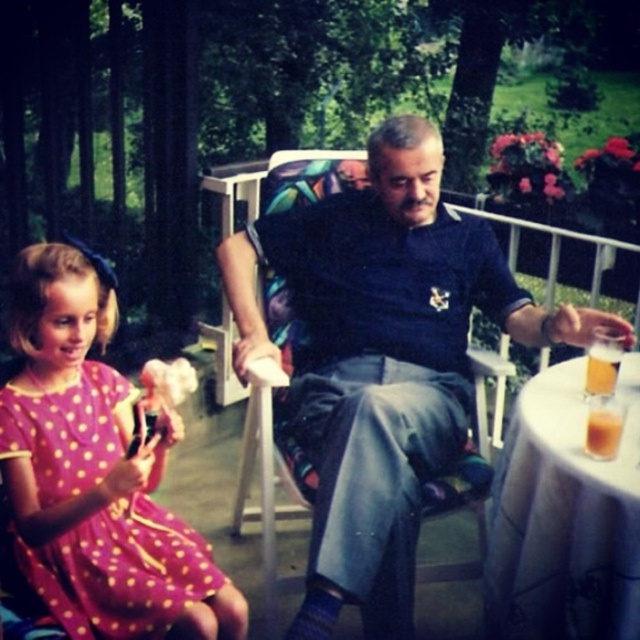
Can you confirm if white cloth-covered table at lower right is taller than translucent glass beer at table right?

Yes.

Can you confirm if white cloth-covered table at lower right is positioned to the right of translucent glass beer at table right?

Incorrect, white cloth-covered table at lower right is not on the right side of translucent glass beer at table right.

Identify the location of white cloth-covered table at lower right. The image size is (640, 640). (563, 516).

Locate an element on the screen. The width and height of the screenshot is (640, 640). white cloth-covered table at lower right is located at coordinates (563, 516).

Does pink polka dot fabric dress at lower left come behind translucent glass beverage at table right?

No.

Is pink polka dot fabric dress at lower left bigger than translucent glass beverage at table right?

Correct, pink polka dot fabric dress at lower left is larger in size than translucent glass beverage at table right.

Which is behind, point (100, 397) or point (600, 381)?

Positioned behind is point (600, 381).

Where is `pink polka dot fabric dress at lower left`? pink polka dot fabric dress at lower left is located at coordinates (120, 570).

Which is above, translucent glass beer at table right or translucent glass beverage at table right?

translucent glass beverage at table right is higher up.

You are a GUI agent. You are given a task and a screenshot of the screen. Output one action in this format:
    pyautogui.click(x=<x>, y=<y>)
    Task: Click on the translucent glass beer at table right
    This screenshot has height=640, width=640.
    Given the screenshot: What is the action you would take?
    pyautogui.click(x=604, y=429)

The width and height of the screenshot is (640, 640). Find the location of `translucent glass beer at table right`. translucent glass beer at table right is located at coordinates (604, 429).